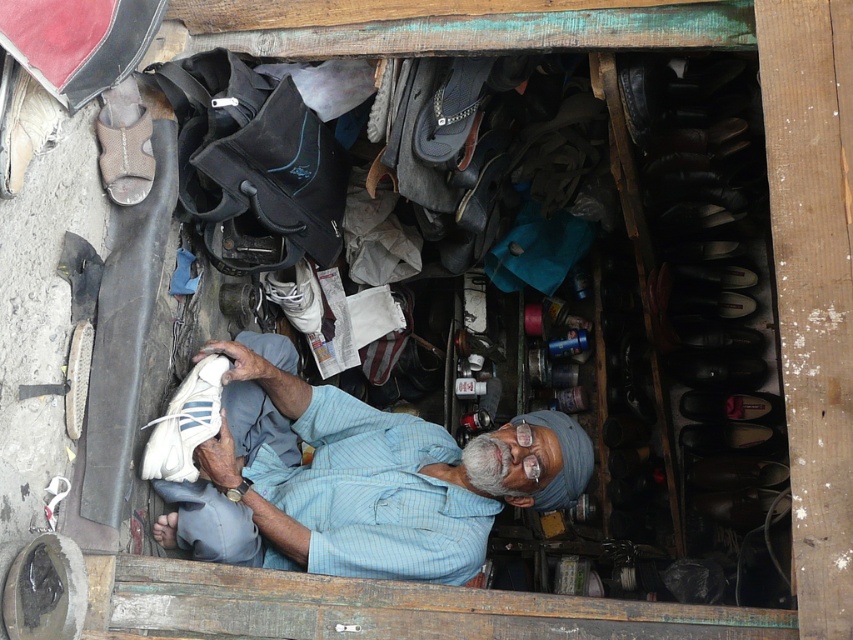
You are organizing a shoe display and need to arrange the white fabric shoe at center and the white fabric shoe at lower left based on their positions. Which shoe should you place lower in the display?

The white fabric shoe at center should be placed lower in the display because it is already positioned below the white fabric shoe at lower left in the original image.

You are organizing a shoe display and need to arrange the white fabric shoe at center and the white fabric shoe at lower left based on their height. Which one should be placed higher up on the shelf?

The white fabric shoe at center should be placed higher up on the shelf because it is taller than the white fabric shoe at lower left.

In the scene shown: You are standing in the workshop and need to place a new shoe exactly where the white fabric shoe at center was. According to the coordinates provided, where should you place the new shoe?

You should place the new shoe at the coordinates point (357, 477) where the white fabric shoe at center was located.